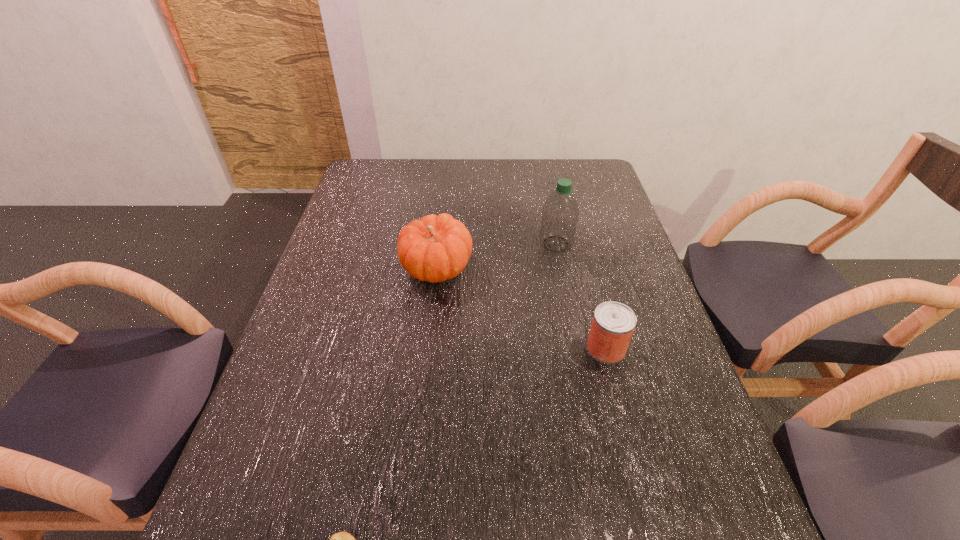
Where is `free space that satisfies the following two spatial constraints: 1. on the front side of the tallest object; 2. on the right side of the third farthest object`? This screenshot has width=960, height=540. free space that satisfies the following two spatial constraints: 1. on the front side of the tallest object; 2. on the right side of the third farthest object is located at coordinates (577, 348).